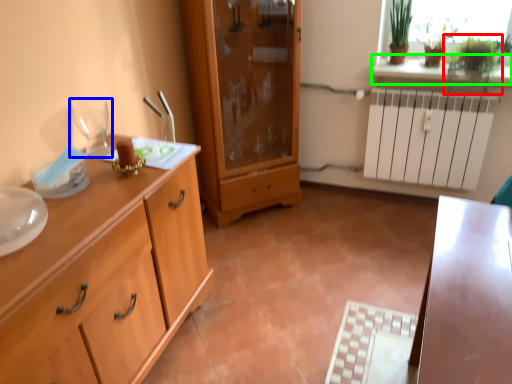
Question: Considering the real-world distances, which object is closest to plant (highlighted by a red box)? wine glass (highlighted by a blue box) or window sill (highlighted by a green box).

Choices:
 (A) wine glass
 (B) window sill

Answer: (B)